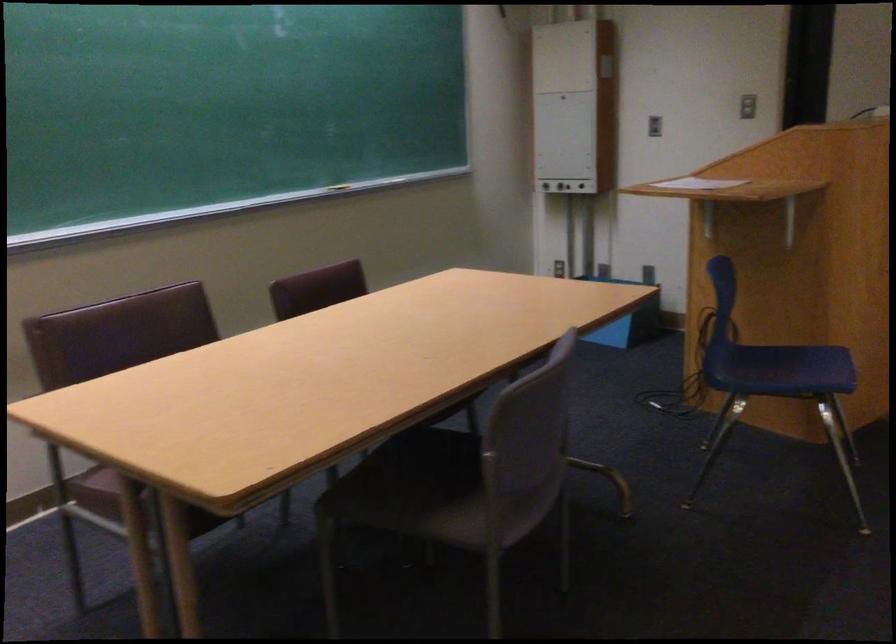
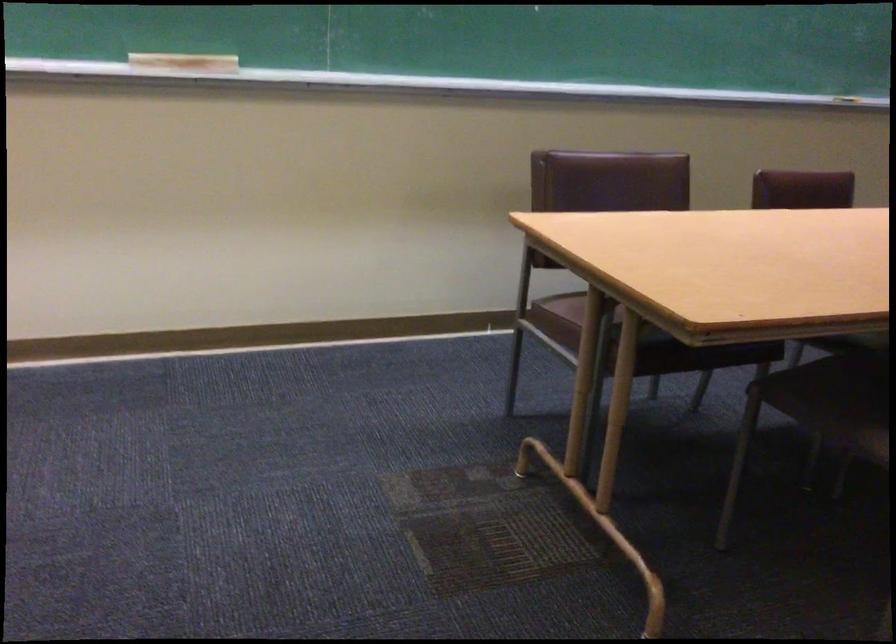
Question: The camera is either moving clockwise (left) or counter-clockwise (right) around the object. The first image is from the beginning of the video and the second image is from the end. Is the camera moving left or right when shooting the video?

Choices:
 (A) Left
 (B) Right

Answer: (B)